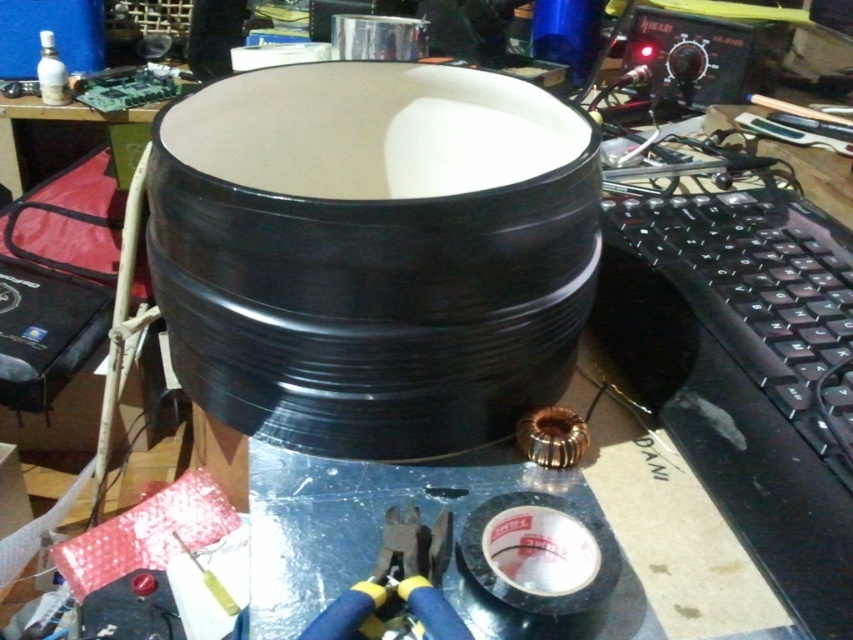
Who is higher up, black glossy drum at center or blue/yellow plastic pliers at lower center?

black glossy drum at center is above.

Who is lower down, black glossy drum at center or blue/yellow plastic pliers at lower center?

Positioned lower is blue/yellow plastic pliers at lower center.

Which is in front, point (224, 403) or point (457, 627)?

Point (457, 627) is in front.

Where is `black glossy drum at center`? black glossy drum at center is located at coordinates (372, 252).